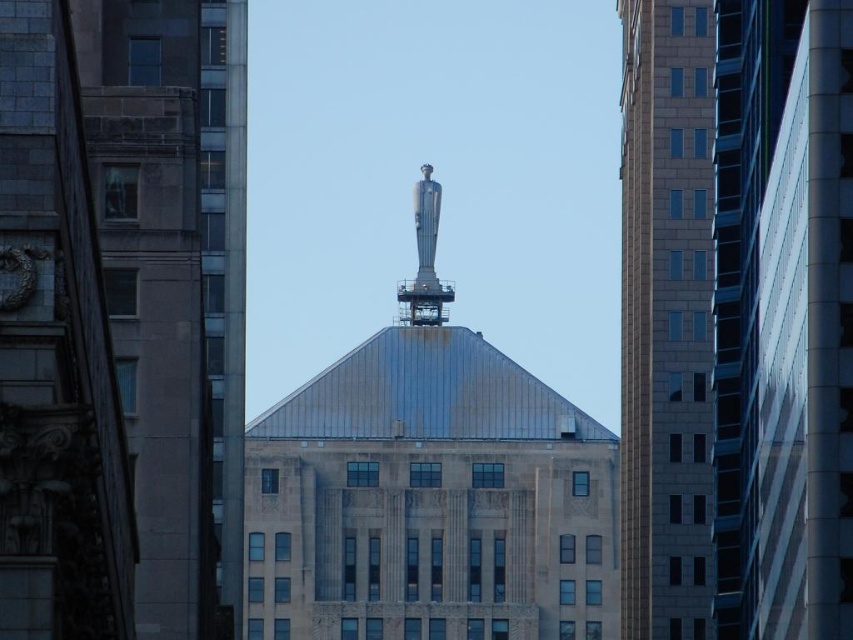
You are standing in the city and want to take a photo of the smooth glass skyscraper at center. If your camera can focus on objects up to 300 feet away, will you need to move closer or farther away to ensure the skyscraper is in focus?

The smooth glass skyscraper at center is 290.12 feet away from the viewer. Since the camera can focus up to 300 feet, you do not need to move closer or farther away. The current distance is within the camera focus range.

You are a city planner reviewing the city layout. You need to determine which building occupies more space in the city skyline. Based on the image, which of the two buildings, the smooth glass skyscraper at center or the slate gray concrete building at right, is taller?

The slate gray concrete building at right is taller than the smooth glass skyscraper at center, so it occupies more space in the city skyline.